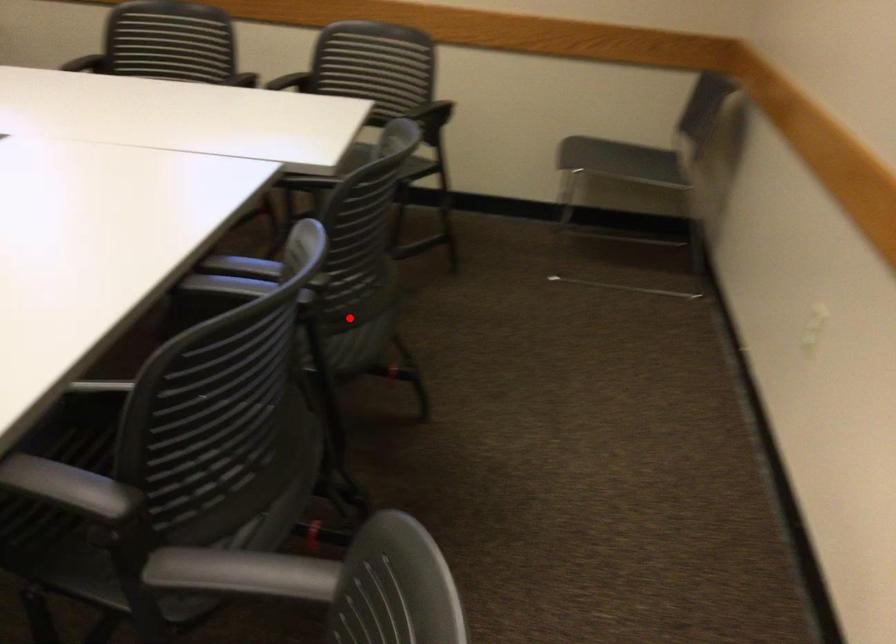
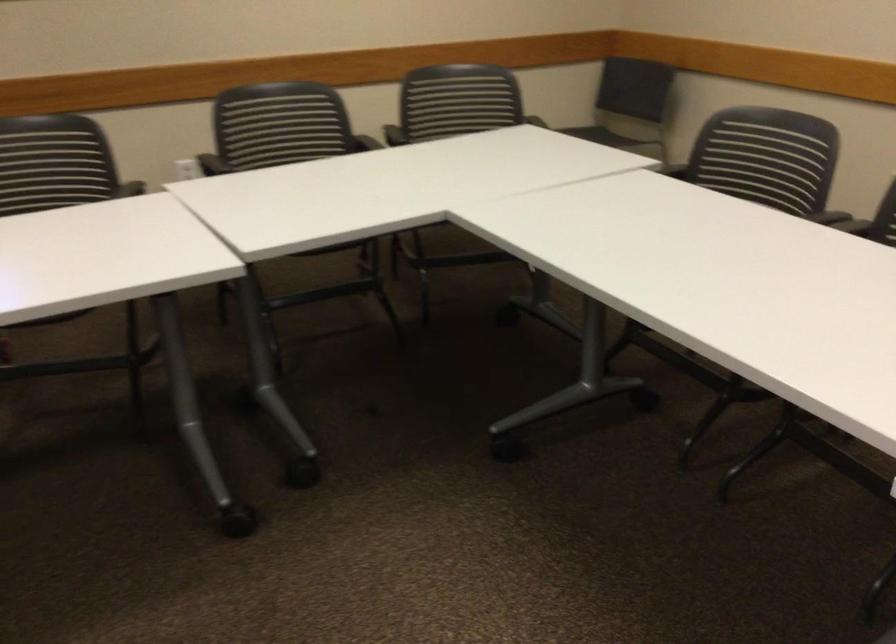
Question: I am providing you with two images of the same scene from different viewpoints. A red point is marked on the first image. Can you still see the location of the red point in image 2?

Choices:
 (A) Yes
 (B) No

Answer: (B)